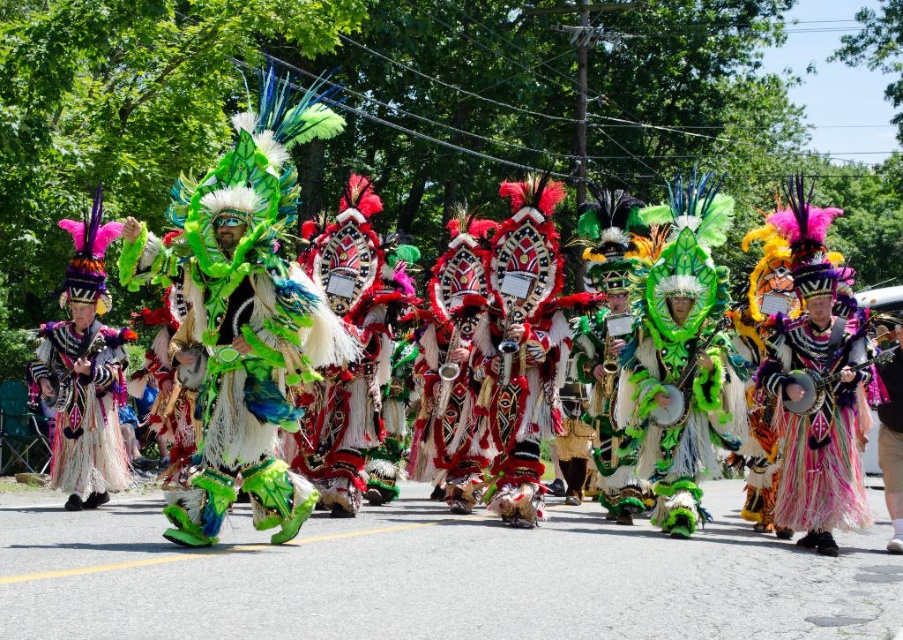
Between shiny green feathers at center and multicolored feathered headdress at center, which one has more height?

multicolored feathered headdress at center is taller.

At what (x,y) coordinates should I click in order to perform the action: click on shiny green feathers at center. Please return your answer as a coordinate pair (x, y). Looking at the image, I should click on (238, 314).

Where is `shiny green feathers at center`? The height and width of the screenshot is (640, 903). shiny green feathers at center is located at coordinates click(x=238, y=314).

Can you confirm if shiny green feathers at center is positioned to the right of shiny metallic headdress at left?

Yes, shiny green feathers at center is to the right of shiny metallic headdress at left.

Is point (494, 342) closer to camera compared to point (53, 465)?

That is True.

Measure the distance between shiny green feathers at center and camera.

The distance of shiny green feathers at center from camera is 29.82 feet.

Image resolution: width=903 pixels, height=640 pixels. In order to click on shiny green feathers at center in this screenshot , I will do `click(238, 314)`.

From the picture: Is multicolored feathered headdress at center positioned at the back of shiny metallic headdress at left?

No, it is not.

Between multicolored feathered headdress at center and shiny metallic headdress at left, which one has more height?

multicolored feathered headdress at center

You are a GUI agent. You are given a task and a screenshot of the screen. Output one action in this format:
    pyautogui.click(x=<x>, y=<y>)
    Task: Click on the multicolored feathered headdress at center
    This screenshot has width=903, height=640.
    Given the screenshot: What is the action you would take?
    click(817, 420)

This screenshot has height=640, width=903. What are the coordinates of `multicolored feathered headdress at center` in the screenshot? It's located at (817, 420).